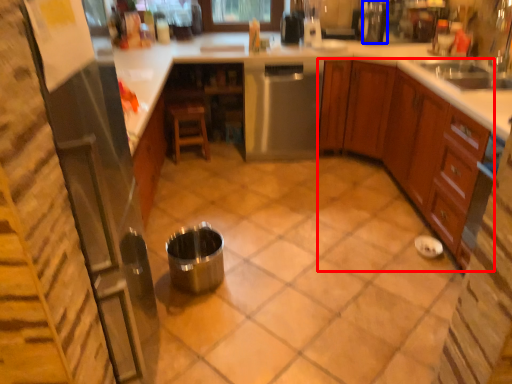
Question: Which object appears closest to the camera in this image, cabinetry (highlighted by a red box) or appliance (highlighted by a blue box)?

Choices:
 (A) cabinetry
 (B) appliance

Answer: (A)